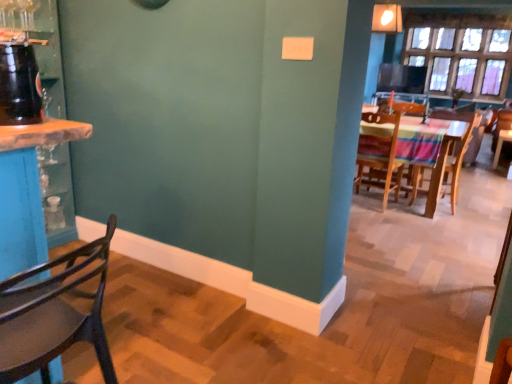
What do you see at coordinates (460, 157) in the screenshot?
I see `wooden chair at center, the third chair when ordered from front to back` at bounding box center [460, 157].

Image resolution: width=512 pixels, height=384 pixels. I want to click on wooden chair at right, marked as the 4th chair in a left-to-right arrangement, so click(x=499, y=133).

This screenshot has width=512, height=384. I want to click on wooden chair at left, which is the fourth chair from back to front, so [x=53, y=315].

The image size is (512, 384). What do you see at coordinates (461, 52) in the screenshot? I see `clear glass window at upper right` at bounding box center [461, 52].

This screenshot has width=512, height=384. Identify the location of wooden chair at center, which is counted as the second chair, starting from the right. (460, 157).

From their relative heights in the image, would you say wooden chair at right, marked as the 4th chair in a front-to-back arrangement, is taller or shorter than wooden chair at left, which is the first chair from left to right?

In the image, wooden chair at right, marked as the 4th chair in a front-to-back arrangement, appears to be shorter than wooden chair at left, which is the first chair from left to right.

Would you say wooden chair at right, marked as the 4th chair in a front-to-back arrangement, is inside or outside wooden chair at left, which is the first chair from left to right?

wooden chair at right, marked as the 4th chair in a front-to-back arrangement, is located beyond the bounds of wooden chair at left, which is the first chair from left to right.

Which is more to the right, wooden chair at right, the first chair positioned from the back, or wooden chair at left, which appears as the 1th chair when viewed from the front?

wooden chair at right, the first chair positioned from the back, is more to the right.

Where is `the 3rd chair behind when counting from the wooden chair at left, arranged as the 4th chair when viewed from the right`? the 3rd chair behind when counting from the wooden chair at left, arranged as the 4th chair when viewed from the right is located at coordinates [499, 133].

Considering the relative positions of wooden chair at center, which is counted as the second chair, starting from the right, and wooden chair at right, positioned as the 2th chair in front-to-back order, in the image provided, is wooden chair at center, which is counted as the second chair, starting from the right, to the right of wooden chair at right, positioned as the 2th chair in front-to-back order, from the viewer's perspective?

Yes.

Can you confirm if wooden chair at center, which is counted as the second chair, starting from the right, is wider than wooden chair at right, positioned as the 2th chair in front-to-back order?

Yes, wooden chair at center, which is counted as the second chair, starting from the right, is wider than wooden chair at right, positioned as the 2th chair in front-to-back order.

How far apart are wooden chair at center, the third chair when ordered from front to back, and wooden chair at right, positioned as the 2th chair in front-to-back order?

A distance of 18.94 inches exists between wooden chair at center, the third chair when ordered from front to back, and wooden chair at right, positioned as the 2th chair in front-to-back order.

Locate an element on the screen. The height and width of the screenshot is (384, 512). the 1st chair below when counting from the wooden chair at right, which ranks as the 3th chair in back-to-front order (from the image's perspective) is located at coordinates (460, 157).

Between wooden chair at center, the second chair from the back, and wooden chair at left, which is the first chair from left to right, which one is positioned in front?

wooden chair at left, which is the first chair from left to right, is closer to the camera.

Is wooden chair at center, which is counted as the second chair, starting from the right, next to wooden chair at left, which appears as the 1th chair when viewed from the front?

No.

Looking at this image, how different are the orientations of wooden chair at center, the third chair when ordered from front to back, and wooden chair at left, which is the first chair from left to right, in degrees?

They differ by 0.674 degrees in their facing directions.

Is wooden chair at center, the third chair when ordered from front to back, oriented towards wooden chair at left, which is the first chair from left to right?

No, wooden chair at center, the third chair when ordered from front to back, is not aimed at wooden chair at left, which is the first chair from left to right.

What's the angular difference between wooden chair at right, which is the third chair from right to left, and wooden chair at left, arranged as the 4th chair when viewed from the right,'s facing directions?

They differ by 90.8 degrees in their facing directions.

Would you say wooden chair at right, positioned as the 2th chair in front-to-back order, is to the left or to the right of wooden chair at left, arranged as the 4th chair when viewed from the right, in the picture?

Clearly, wooden chair at right, positioned as the 2th chair in front-to-back order, is on the right of wooden chair at left, arranged as the 4th chair when viewed from the right, in the image.

Can you confirm if wooden chair at right, which is the second chair in left-to-right order, is wider than wooden chair at left, arranged as the 4th chair when viewed from the right?

No.

Between wooden chair at right, which is the third chair from right to left, and wooden chair at left, which is the fourth chair from back to front, which one has more height?

With more height is wooden chair at right, which is the third chair from right to left.

Is wooden chair at left, arranged as the 4th chair when viewed from the right, far from wooden chair at right, the first chair positioned from the back?

wooden chair at left, arranged as the 4th chair when viewed from the right, is far away from wooden chair at right, the first chair positioned from the back.

Could you tell me if wooden chair at left, which is the first chair from left to right, is facing wooden chair at right, the first chair positioned from the right?

No, wooden chair at left, which is the first chair from left to right, is not turned towards wooden chair at right, the first chair positioned from the right.

Considering the sizes of wooden chair at left, which is the first chair from left to right, and wooden chair at right, the first chair positioned from the back, in the image, is wooden chair at left, which is the first chair from left to right, wider or thinner than wooden chair at right, the first chair positioned from the back,?

In the image, wooden chair at left, which is the first chair from left to right, appears to be wider than wooden chair at right, the first chair positioned from the back.

Between wooden chair at right, marked as the 4th chair in a left-to-right arrangement, and wooden chair at center, the third chair when ordered from front to back, which one has larger size?

With larger size is wooden chair at center, the third chair when ordered from front to back.

Which is more to the left, wooden chair at right, marked as the 4th chair in a left-to-right arrangement, or wooden chair at center, the third chair when ordered from front to back?

wooden chair at center, the third chair when ordered from front to back.

From a real-world perspective, is wooden chair at right, marked as the 4th chair in a left-to-right arrangement, positioned over wooden chair at center, which is counted as the second chair, starting from the right, based on gravity?

Actually, wooden chair at right, marked as the 4th chair in a left-to-right arrangement, is physically below wooden chair at center, which is counted as the second chair, starting from the right, in the real world.

Is wooden chair at right, marked as the 4th chair in a left-to-right arrangement, located outside wooden chair at center, the third chair positioned from the left?

wooden chair at right, marked as the 4th chair in a left-to-right arrangement, is positioned outside wooden chair at center, the third chair positioned from the left.

From the image's perspective, which object appears higher, clear glass window at upper right or wooden chair at center, the third chair when ordered from front to back?

clear glass window at upper right appears higher in the image.

Is clear glass window at upper right to the left of wooden chair at center, the third chair when ordered from front to back, from the viewer's perspective?

In fact, clear glass window at upper right is to the right of wooden chair at center, the third chair when ordered from front to back.

Is clear glass window at upper right beside wooden chair at center, the third chair when ordered from front to back?

No, clear glass window at upper right is not in contact with wooden chair at center, the third chair when ordered from front to back.

The image size is (512, 384). There is a wooden chair at left, which appears as the 1th chair when viewed from the front. In order to click on the 3rd chair above it (from the image's perspective) in this screenshot , I will do `click(499, 133)`.

From the image's perspective, starting from the wooden chair at right, which is the second chair in left-to-right order, which chair is the 1st one below? Please provide its 2D coordinates.

[(460, 157)]

From the image, which object appears to be nearer to wooden chair at right, positioned as the 2th chair in front-to-back order, wooden chair at left, arranged as the 4th chair when viewed from the right, or clear glass window at upper right?

clear glass window at upper right is positioned closer to the anchor wooden chair at right, positioned as the 2th chair in front-to-back order.

When comparing their distances from clear glass window at upper right, does wooden chair at left, arranged as the 4th chair when viewed from the right, or wooden chair at center, the third chair positioned from the left, seem closer?

The object closer to clear glass window at upper right is wooden chair at center, the third chair positioned from the left.

Looking at the image, which one is located further to wooden chair at left, arranged as the 4th chair when viewed from the right, wooden chair at center, which is counted as the second chair, starting from the right, or clear glass window at upper right?

clear glass window at upper right is positioned further to the anchor wooden chair at left, arranged as the 4th chair when viewed from the right.

Which object lies nearer to the anchor point wooden chair at left, which is the fourth chair from back to front, wooden chair at right, positioned as the 2th chair in front-to-back order, or wooden chair at center, the third chair when ordered from front to back?

wooden chair at right, positioned as the 2th chair in front-to-back order, is closer to wooden chair at left, which is the fourth chair from back to front.

Based on their spatial positions, is clear glass window at upper right or wooden chair at left, which is the fourth chair from back to front, further from wooden chair at right, which is the third chair from right to left?

wooden chair at left, which is the fourth chair from back to front, is positioned further to the anchor wooden chair at right, which is the third chair from right to left.

In the scene shown: From the image, which object appears to be nearer to wooden chair at center, which is counted as the second chair, starting from the right, clear glass window at upper right or wooden chair at right, positioned as the 2th chair in front-to-back order?

wooden chair at right, positioned as the 2th chair in front-to-back order, lies closer to wooden chair at center, which is counted as the second chair, starting from the right, than the other object.

When comparing their distances from wooden chair at right, the first chair positioned from the back, does wooden chair at center, the second chair from the back, or wooden chair at right, positioned as the 2th chair in front-to-back order, seem further?

Among the two, wooden chair at right, positioned as the 2th chair in front-to-back order, is located further to wooden chair at right, the first chair positioned from the back.

Estimate the real-world distances between objects in this image. Which object is further from clear glass window at upper right, wooden chair at center, the third chair positioned from the left, or wooden chair at right, which ranks as the 3th chair in back-to-front order?

wooden chair at right, which ranks as the 3th chair in back-to-front order.

Identify the location of chair positioned between wooden chair at center, which is counted as the second chair, starting from the right, and clear glass window at upper right from near to far. (499, 133).

This screenshot has width=512, height=384. Find the location of `chair between wooden chair at left, which is the fourth chair from back to front, and wooden chair at center, which is counted as the second chair, starting from the right, along the z-axis`. chair between wooden chair at left, which is the fourth chair from back to front, and wooden chair at center, which is counted as the second chair, starting from the right, along the z-axis is located at coordinates (379, 155).

Where is `chair between wooden chair at right, which is the second chair in left-to-right order, and wooden chair at right, marked as the 4th chair in a left-to-right arrangement, along the z-axis`? This screenshot has width=512, height=384. chair between wooden chair at right, which is the second chair in left-to-right order, and wooden chair at right, marked as the 4th chair in a left-to-right arrangement, along the z-axis is located at coordinates (460, 157).